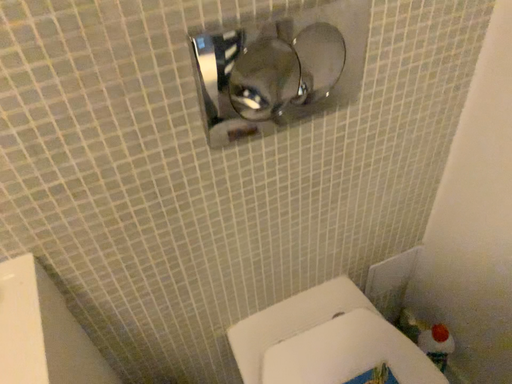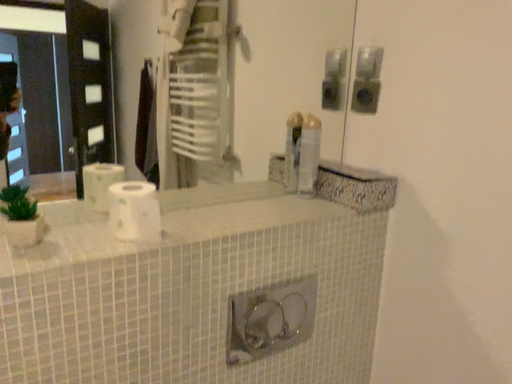
Question: Which way did the camera rotate in the video?

Choices:
 (A) rotated upward
 (B) rotated downward

Answer: (A)